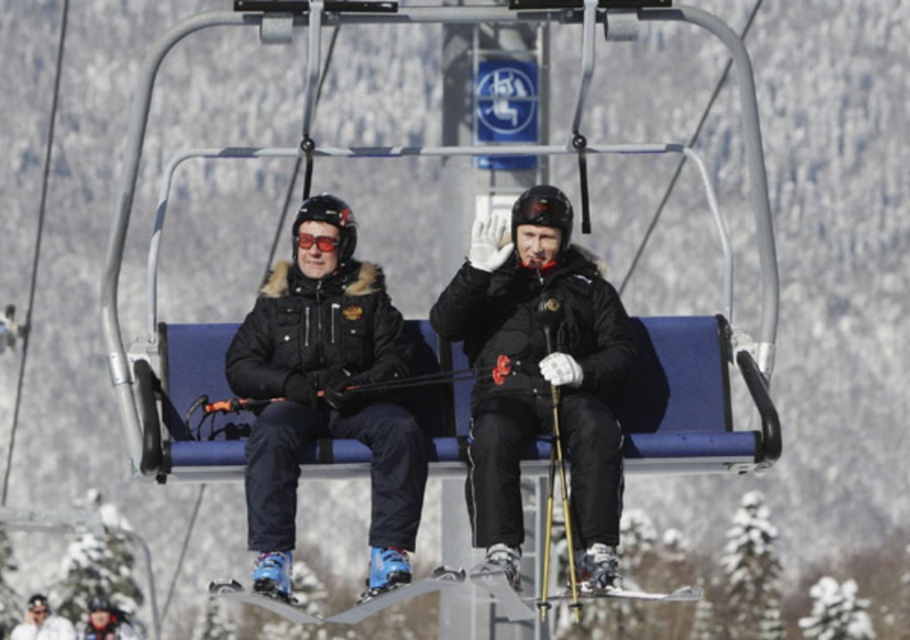
Question: Among these points, which one is farthest from the camera?

Choices:
 (A) (302, 237)
 (B) (438, 392)
 (C) (450, 584)
 (D) (508, 504)

Answer: (A)

Question: Does matte black jacket at center lie behind red reflective goggles at center?

Choices:
 (A) no
 (B) yes

Answer: (A)

Question: Is metallic skis at center to the left of blue matte ski at lower center from the viewer's perspective?

Choices:
 (A) yes
 (B) no

Answer: (B)

Question: Which object is the farthest from the red reflective goggles at center?

Choices:
 (A) blue matte ski at lower center
 (B) metallic skis at center

Answer: (B)

Question: Is metallic skis at center smaller than red reflective goggles at center?

Choices:
 (A) no
 (B) yes

Answer: (A)

Question: Which point appears farthest from the camera in this image?

Choices:
 (A) (x=494, y=586)
 (B) (x=472, y=500)

Answer: (B)